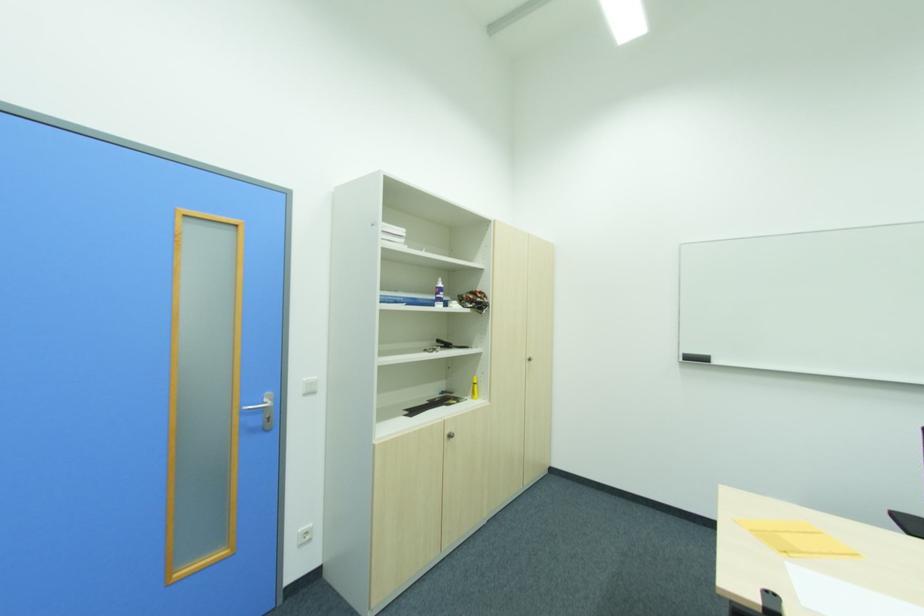
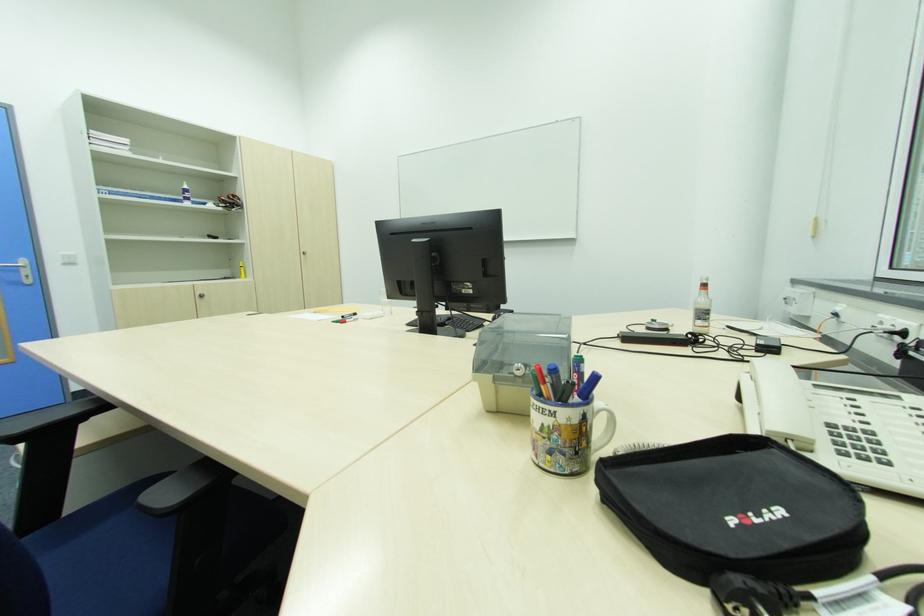
In a continuous first-person perspective shot, in which direction is the camera moving?

The cameraman moved toward right, backward.